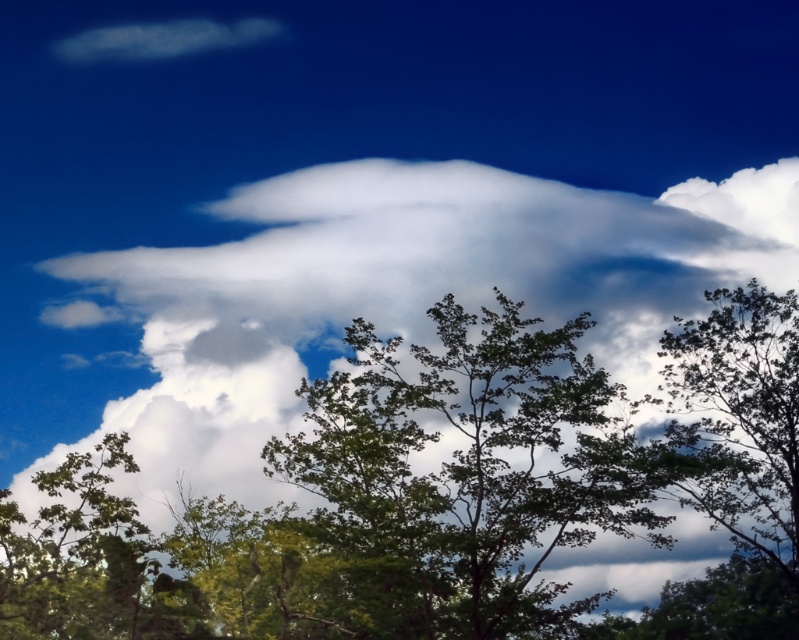
This screenshot has height=640, width=799. What are the coordinates of `white fluffy cloud at upper center` in the screenshot? It's located at (392, 291).

You are a GUI agent. You are given a task and a screenshot of the screen. Output one action in this format:
    pyautogui.click(x=<x>, y=<y>)
    Task: Click on the white fluffy cloud at upper center
    The image size is (799, 640).
    Given the screenshot: What is the action you would take?
    pyautogui.click(x=392, y=291)

Can you confirm if white fluffy cloud at upper center is thinner than green leafy tree at center?

In fact, white fluffy cloud at upper center might be wider than green leafy tree at center.

Does point (275, 292) come behind point (468, 554)?

Yes, it is behind point (468, 554).

Is point (733, 244) farther from camera compared to point (307, 458)?

Yes, point (733, 244) is behind point (307, 458).

Where is `white fluffy cloud at upper center`? white fluffy cloud at upper center is located at coordinates (392, 291).

Looking at this image, who is shorter, green leafy tree at center or green leafy tree at upper right?

green leafy tree at upper right is shorter.

Does point (525, 372) come in front of point (776, 397)?

Yes.

Identify the location of green leafy tree at center. The image size is (799, 640). (470, 474).